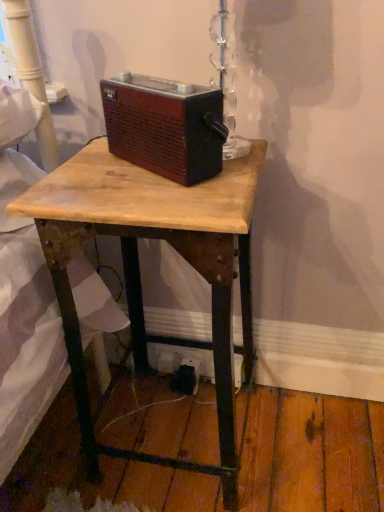
The height and width of the screenshot is (512, 384). Identify the location of vacant area situated below wooden desk at center (from a real-world perspective). (178, 426).